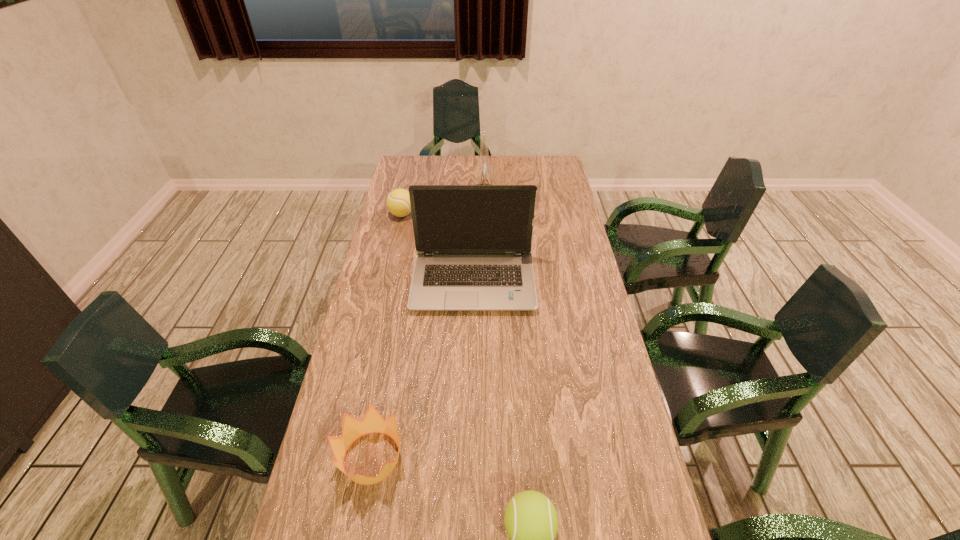
This screenshot has height=540, width=960. Identify the location of crown that is at the left edge. (352, 428).

Locate an element on the screen. vacant space at the left edge of the desktop is located at coordinates (324, 521).

The width and height of the screenshot is (960, 540). I want to click on vacant space at the right edge of the desktop, so click(x=552, y=304).

The width and height of the screenshot is (960, 540). I want to click on free space at the far right corner of the desktop, so click(x=532, y=170).

In order to click on free space between the third farthest object and the fourth farthest object in this screenshot , I will do `click(422, 370)`.

This screenshot has height=540, width=960. Find the location of `empty space that is in between the oil lamp and the crown`. empty space that is in between the oil lamp and the crown is located at coordinates (428, 334).

Where is `free space between the left tennis ball and the second nearest object`? This screenshot has height=540, width=960. free space between the left tennis ball and the second nearest object is located at coordinates (387, 336).

Where is `free point between the second nearest object and the oil lamp`? free point between the second nearest object and the oil lamp is located at coordinates (428, 334).

Locate an element on the screen. The width and height of the screenshot is (960, 540). object that stands as the fourth closest to the left tennis ball is located at coordinates (531, 522).

The height and width of the screenshot is (540, 960). What are the coordinates of `the third closest object relative to the oil lamp` in the screenshot? It's located at (352, 428).